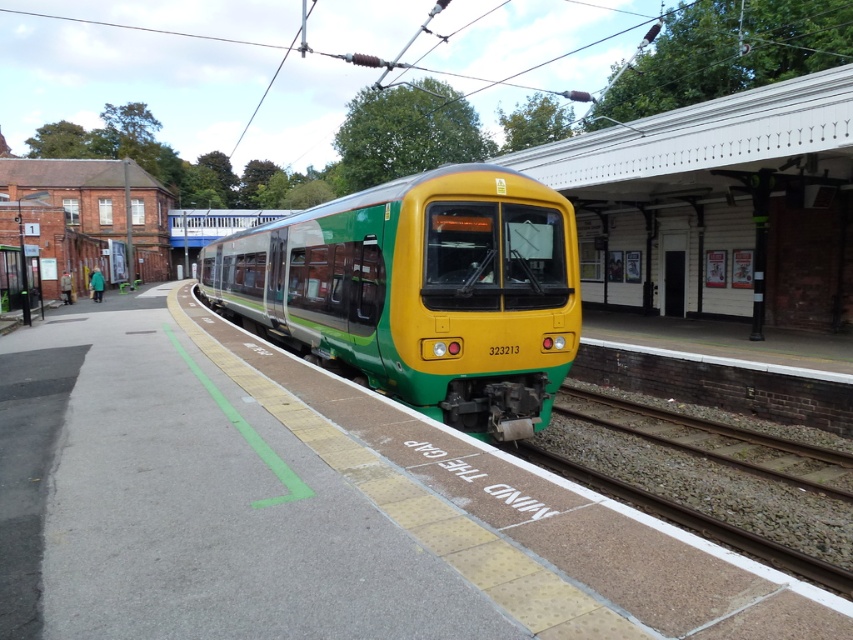
I want to click on green matte train at center, so click(x=421, y=291).

Does green matte train at center have a smaller size compared to green gravel train track at lower center?

Incorrect, green matte train at center is not smaller in size than green gravel train track at lower center.

Who is more distant from viewer, (207,252) or (697,528)?

Point (207,252)

You are a GUI agent. You are given a task and a screenshot of the screen. Output one action in this format:
    pyautogui.click(x=<x>, y=<y>)
    Task: Click on the green matte train at center
    This screenshot has height=640, width=853.
    Given the screenshot: What is the action you would take?
    pyautogui.click(x=421, y=291)